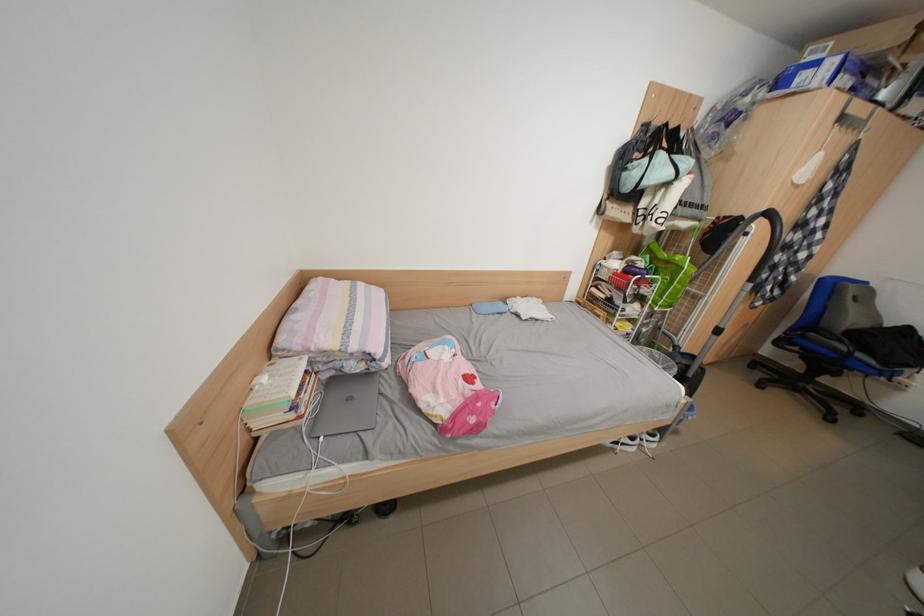
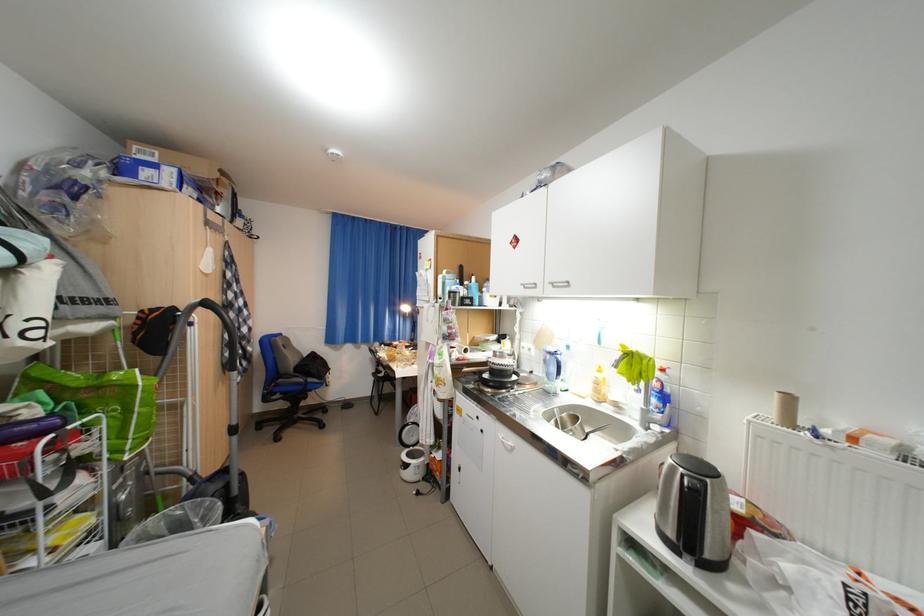
Question: The camera is either moving clockwise (left) or counter-clockwise (right) around the object. The first image is from the beginning of the video and the second image is from the end. Is the camera moving left or right when shooting the video?

Choices:
 (A) Left
 (B) Right

Answer: (A)